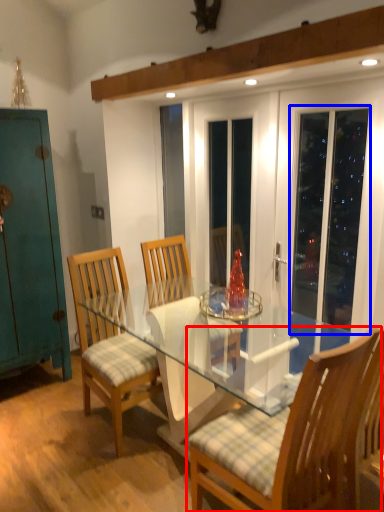
Question: Among these objects, which one is farthest to the camera, chair (highlighted by a red box) or screen door (highlighted by a blue box)?

Choices:
 (A) chair
 (B) screen door

Answer: (B)